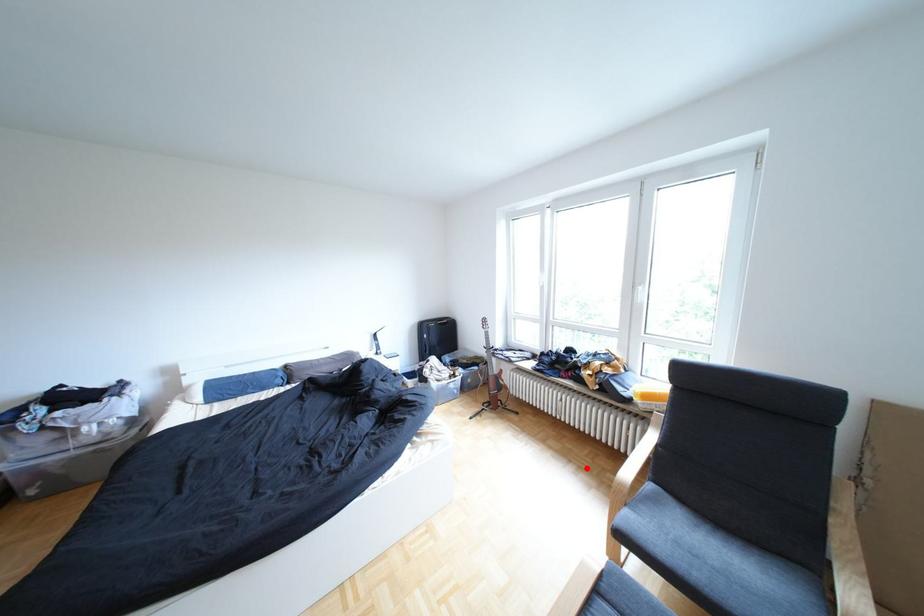
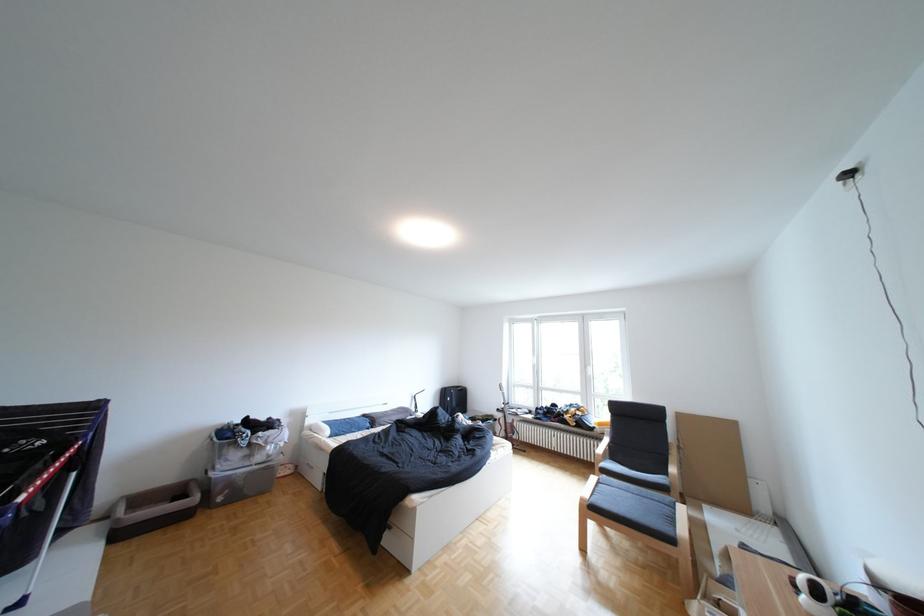
Question: I am providing you with two images of the same scene from different viewpoints. Given a red point in image1, look at the same physical point in image2. Is it:

Choices:
 (A) Closer to the viewpoint
 (B) Farther from the viewpoint

Answer: (B)